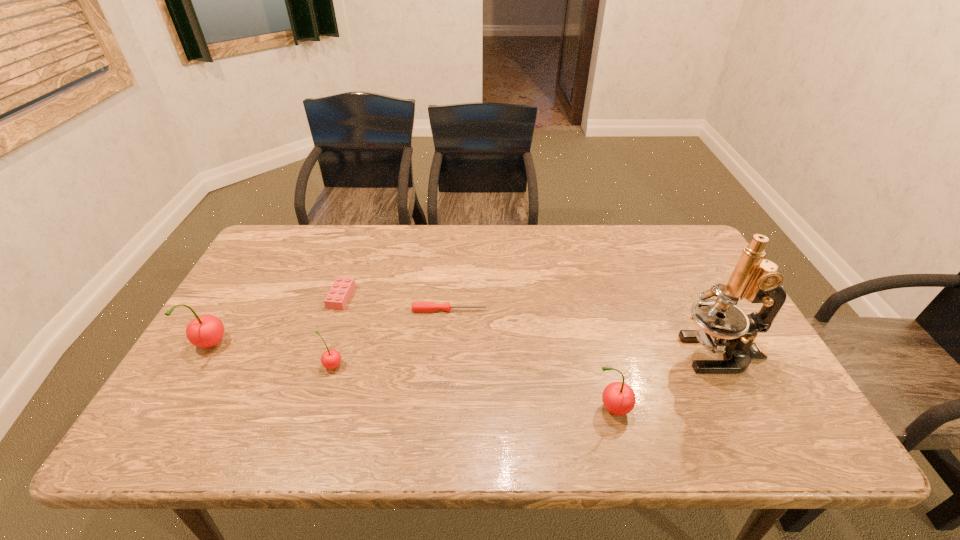
This screenshot has width=960, height=540. What are the coordinates of `the leftmost cherry` in the screenshot? It's located at (205, 331).

Where is `the second cherry from right to left`? The image size is (960, 540). the second cherry from right to left is located at coordinates (330, 359).

Image resolution: width=960 pixels, height=540 pixels. I want to click on the fourth tallest object, so click(x=330, y=359).

What are the coordinates of `the second tallest cherry` in the screenshot? It's located at (x=618, y=398).

Identify the location of the nearest cherry. The image size is (960, 540). (618, 398).

Find the location of `the fifth tallest object`. the fifth tallest object is located at coordinates (338, 296).

The image size is (960, 540). Find the location of `the shortest object`. the shortest object is located at coordinates (425, 307).

Where is `screwdriver`? screwdriver is located at coordinates click(x=425, y=307).

Identify the location of the tallest object. (724, 328).

Find the location of a particular element. This screenshot has height=540, width=960. microscope is located at coordinates (724, 328).